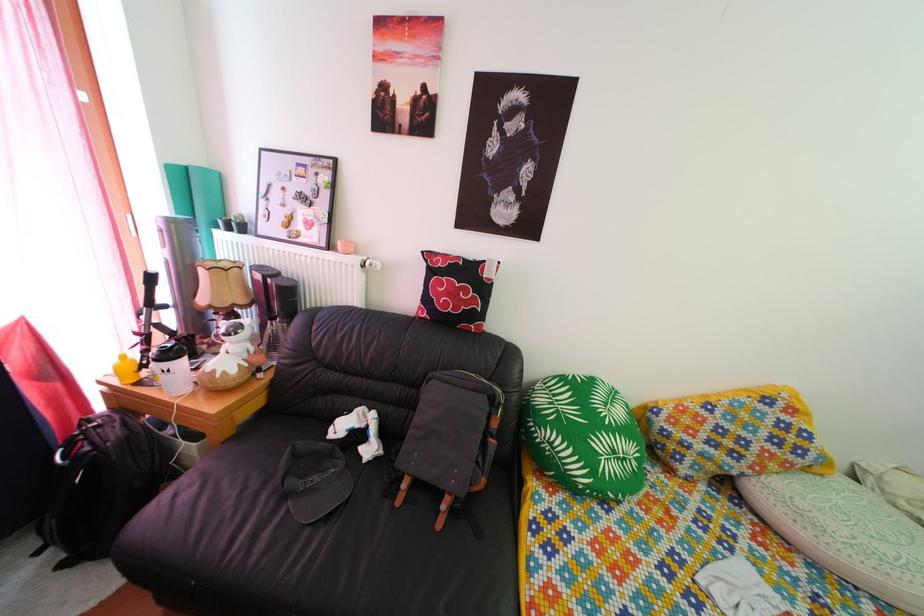
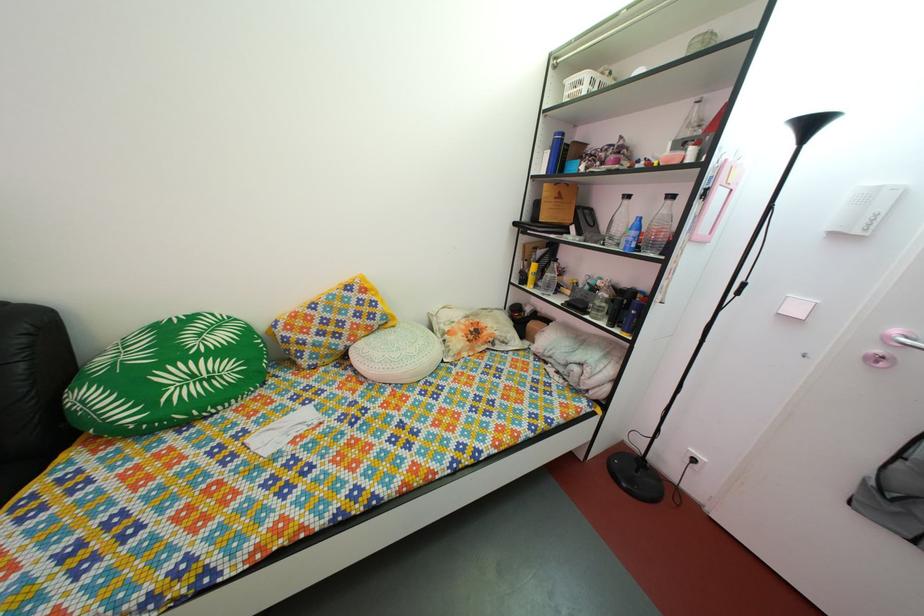
Locate, in the second image, the point that corresponds to pixel 634 468 in the first image.

(220, 387)